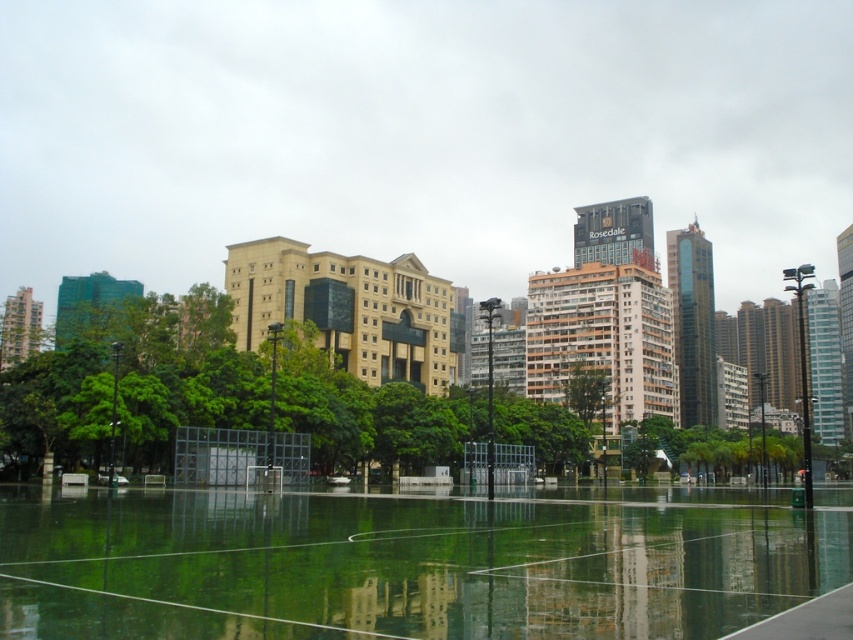
In the scene shown: Who is taller, transparent glass court at center or green leafy tree at center?

With more height is green leafy tree at center.

Is transparent glass court at center positioned in front of green leafy tree at center?

Yes, it is in front of green leafy tree at center.

This screenshot has width=853, height=640. Identify the location of transparent glass court at center. (407, 564).